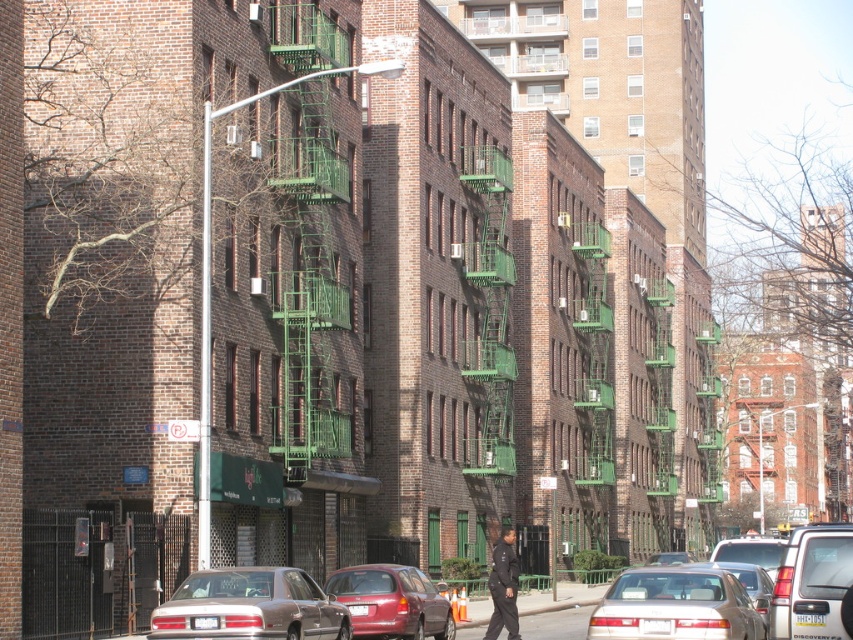
You are a painter standing on the sidewalk. You need to paint the green matte fire escape at center and the metallic silver sedan at lower center. Which object requires a taller ladder to reach its top?

The green matte fire escape at center requires a taller ladder because it has a greater height compared to the metallic silver sedan at lower center.

You are standing on the sidewalk in front of the brick apartment buildings and want to locate the green matte fire escape at center. According to the coordinates provided, where exactly is it positioned?

The green matte fire escape at center is located at point 0.489 on the x axis and 0.576 on the y axis.

You are standing on the sidewalk in the street scene and want to walk towards both the point at coordinates point (x=738, y=620) and the point at coordinates point (x=796, y=580). Which point will you reach first?

You will reach point (x=738, y=620) first because it is closer to you than point (x=796, y=580), which is further away.